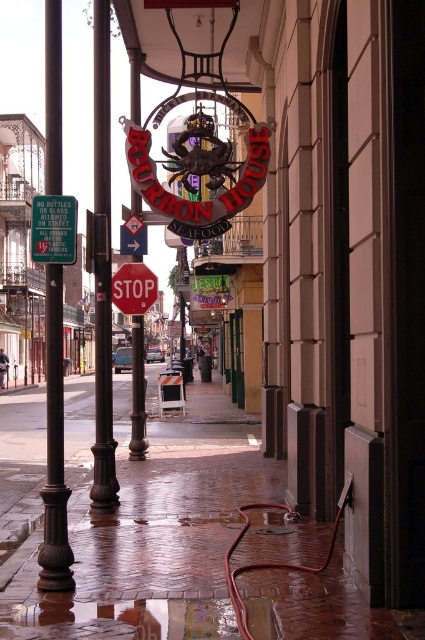
Can you confirm if wet brick pavement at center is positioned below white plastic arrow at center?

Correct, wet brick pavement at center is located below white plastic arrow at center.

Does wet brick pavement at center appear on the right side of white plastic arrow at center?

In fact, wet brick pavement at center is to the left of white plastic arrow at center.

Who is more distant from viewer, (204, 560) or (144, 225)?

Positioned behind is point (144, 225).

I want to click on wet brick pavement at center, so click(130, 516).

Which is below, black metal pole at left or white plastic arrow at center?

white plastic arrow at center is lower down.

Is black metal pole at left taller than white plastic arrow at center?

Correct, black metal pole at left is much taller as white plastic arrow at center.

Where is `black metal pole at left`? The height and width of the screenshot is (640, 425). black metal pole at left is located at coordinates (102, 268).

From the picture: Can you confirm if wet brick pavement at center is wider than red glossy stop sign at center?

Yes, wet brick pavement at center is wider than red glossy stop sign at center.

Is point (161, 589) positioned before point (152, 289)?

Yes, point (161, 589) is in front of point (152, 289).

Is point (300, 579) farther from viewer compared to point (127, 272)?

No, (300, 579) is in front of (127, 272).

Identify the location of wet brick pavement at center. The height and width of the screenshot is (640, 425). pyautogui.click(x=130, y=516).